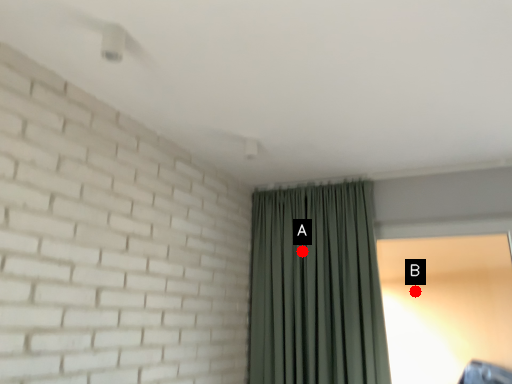
Question: Two points are circled on the image, labeled by A and B beside each circle. Which of the following is the farthest from the observer?

Choices:
 (A) A is further
 (B) B is further

Answer: (A)